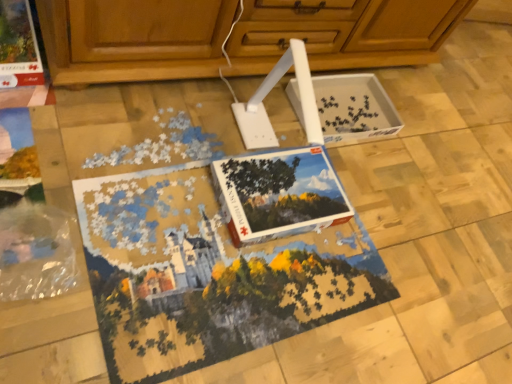
Question: From a real-world perspective, is wooden cabinet at upper center on white cardboard puzzle box at center, which is the 2th magazine from left to right?

Choices:
 (A) no
 (B) yes

Answer: (B)

Question: Is white cardboard puzzle box at center, the 2th magazine from the top, at the back of wooden cabinet at upper center?

Choices:
 (A) no
 (B) yes

Answer: (A)

Question: Is wooden cabinet at upper center at the right side of white cardboard puzzle box at center, which is the first magazine in bottom-to-top order?

Choices:
 (A) no
 (B) yes

Answer: (A)

Question: Does wooden cabinet at upper center turn towards white cardboard puzzle box at center, the 1th magazine from the right?

Choices:
 (A) yes
 (B) no

Answer: (A)

Question: Is wooden cabinet at upper center not close to white cardboard puzzle box at center, which is the first magazine in bottom-to-top order?

Choices:
 (A) yes
 (B) no

Answer: (B)

Question: Is white cardboard puzzle box at center, the 1th magazine from the right, located within wooden cabinet at upper center?

Choices:
 (A) yes
 (B) no

Answer: (B)

Question: Does wooden cabinet at upper center lie behind matte cardboard magazine at upper left, the 1th magazine from the left?

Choices:
 (A) no
 (B) yes

Answer: (A)

Question: From the image's perspective, would you say wooden cabinet at upper center is positioned over matte cardboard magazine at upper left, which is the second magazine from right to left?

Choices:
 (A) yes
 (B) no

Answer: (A)

Question: Are wooden cabinet at upper center and matte cardboard magazine at upper left, the 1th magazine from the left, located far from each other?

Choices:
 (A) yes
 (B) no

Answer: (B)

Question: Can you confirm if wooden cabinet at upper center is positioned to the right of matte cardboard magazine at upper left, the 1th magazine from the left?

Choices:
 (A) no
 (B) yes

Answer: (B)

Question: Can you confirm if wooden cabinet at upper center is shorter than matte cardboard magazine at upper left, which is the second magazine from right to left?

Choices:
 (A) no
 (B) yes

Answer: (A)

Question: Is wooden cabinet at upper center placed right next to matte cardboard magazine at upper left, which appears as the 1th magazine when viewed from the top?

Choices:
 (A) yes
 (B) no

Answer: (B)

Question: From a real-world perspective, is matte cardboard magazine at upper left, which is the second magazine from right to left, positioned under white cardboard puzzle box at center, the 1th magazine from the right, based on gravity?

Choices:
 (A) yes
 (B) no

Answer: (B)